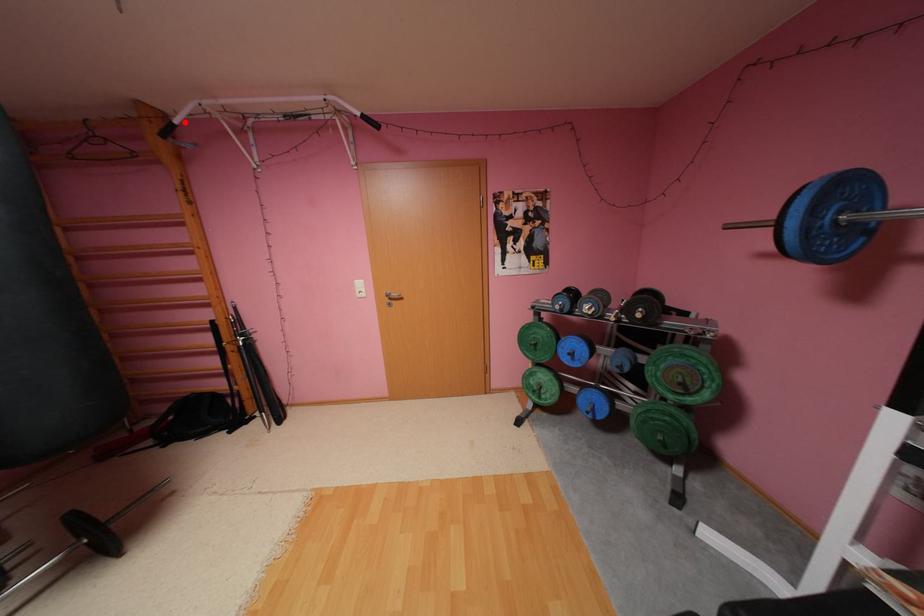
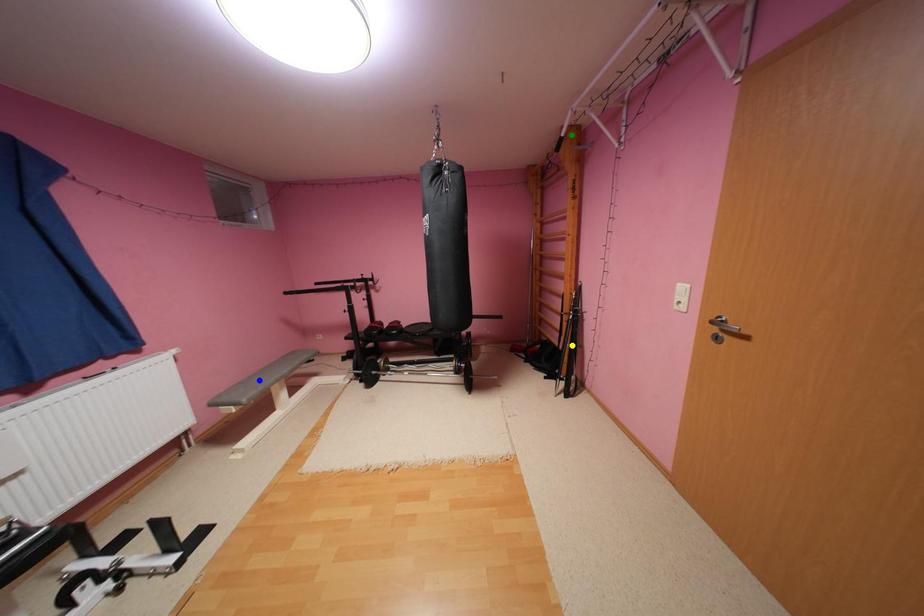
Question: I am providing you with two images of the same scene from different viewpoints. A red point is marked on the first image. You are given multiple points on the second image. Which spot in image 2 lines up with the point in image 1?

Choices:
 (A) yellow point
 (B) green point
 (C) blue point

Answer: (B)